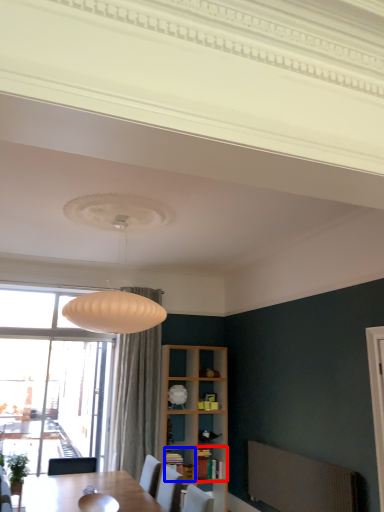
Question: Which point is further to the camera, cabinet (highlighted by a red box) or shelf (highlighted by a blue box)?

Choices:
 (A) cabinet
 (B) shelf

Answer: (A)